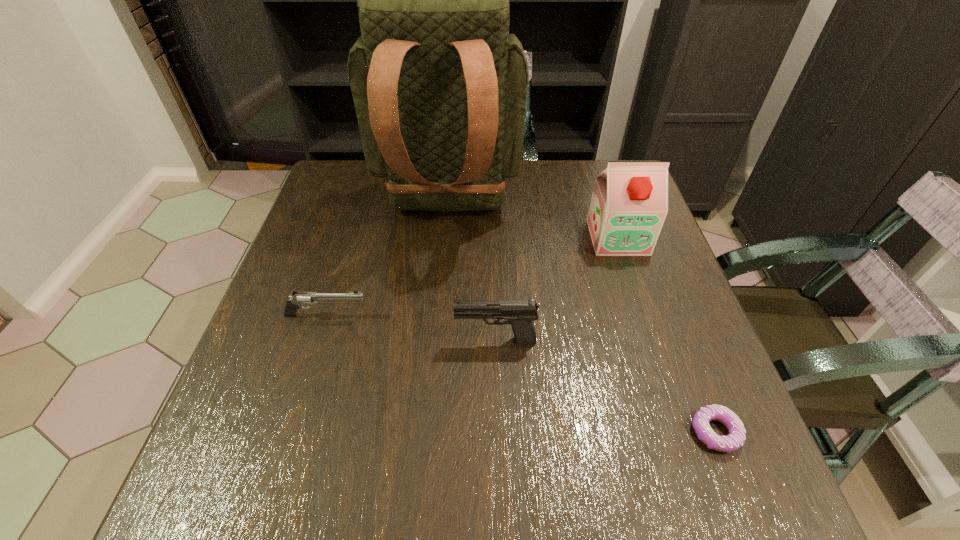
Find the location of a particular element. This screenshot has height=540, width=960. object that is at the near right corner is located at coordinates (736, 438).

Identify the location of vacant point at the far edge. (379, 199).

The image size is (960, 540). I want to click on vacant space at the left edge of the desktop, so click(x=352, y=270).

In the image, there is a desktop. At what (x,y) coordinates should I click in order to perform the action: click on free space at the right edge. Please return your answer as a coordinate pair (x, y). The image size is (960, 540). Looking at the image, I should click on (711, 357).

Identify the location of vacant region at the far left corner of the desktop. This screenshot has height=540, width=960. (324, 197).

Identify the location of free space between the tallest object and the fourth shortest object. (533, 223).

Find the location of `vacant space in between the left pistol and the doughnut`. vacant space in between the left pistol and the doughnut is located at coordinates (521, 374).

Find the location of a particular element. The image size is (960, 540). free space between the nearest object and the soya milk is located at coordinates (666, 335).

The width and height of the screenshot is (960, 540). Identify the location of blank region between the shorter pistol and the fourth shortest object. (472, 276).

Where is `unoccupied area between the backpack and the fourth shortest object`? The image size is (960, 540). unoccupied area between the backpack and the fourth shortest object is located at coordinates (533, 223).